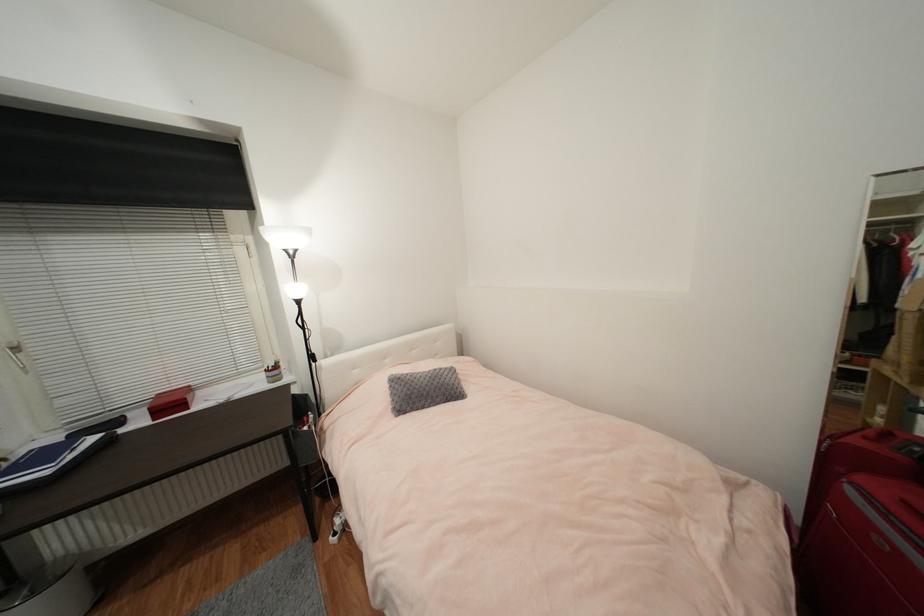
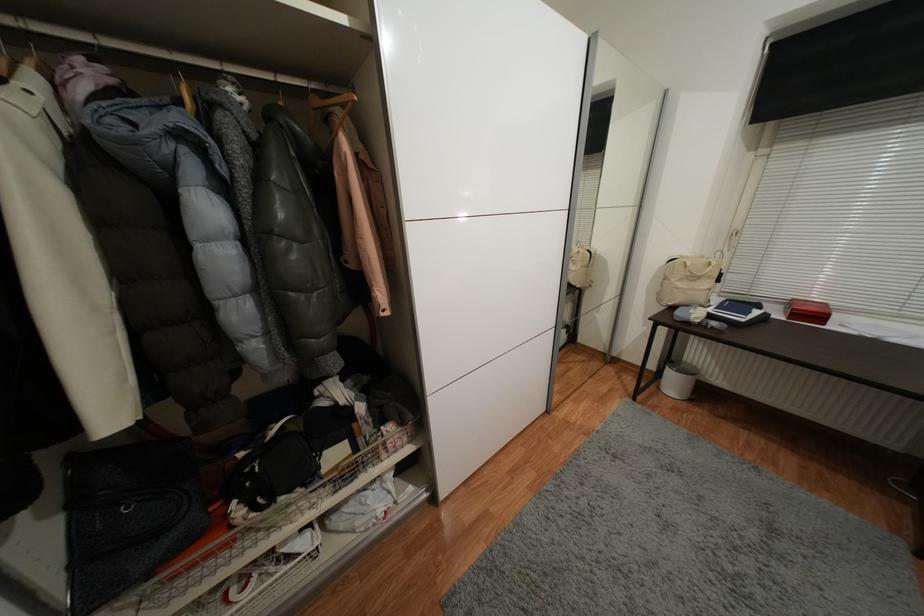
Locate, in the second image, the point that corresponds to pixel 52 474 in the first image.

(747, 321)